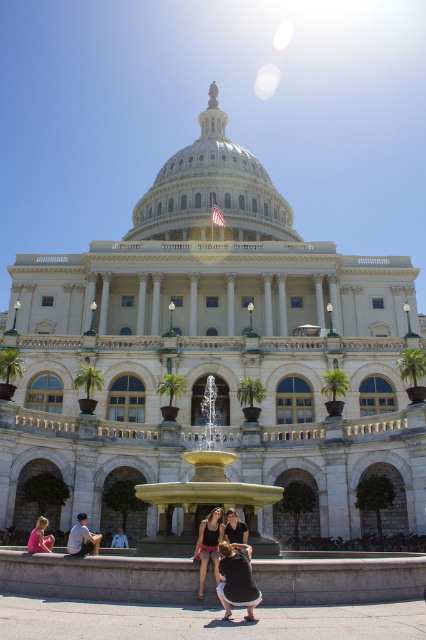
You are standing at the golden fountain in front of the white marble palace at center. If you want to walk directly towards the palace, which direction should you face?

Since the white marble palace at center is located at point (213, 349), you should face north to walk directly towards it.

You are standing at the golden fountain in front of the neoclassical building. You notice two points marked on the ground at coordinates point (189, 540) and point (213, 540). Which point is closer to you as you face the building?

Point (213, 540) is closer to you because it is in front of point (189, 540), which is behind it.